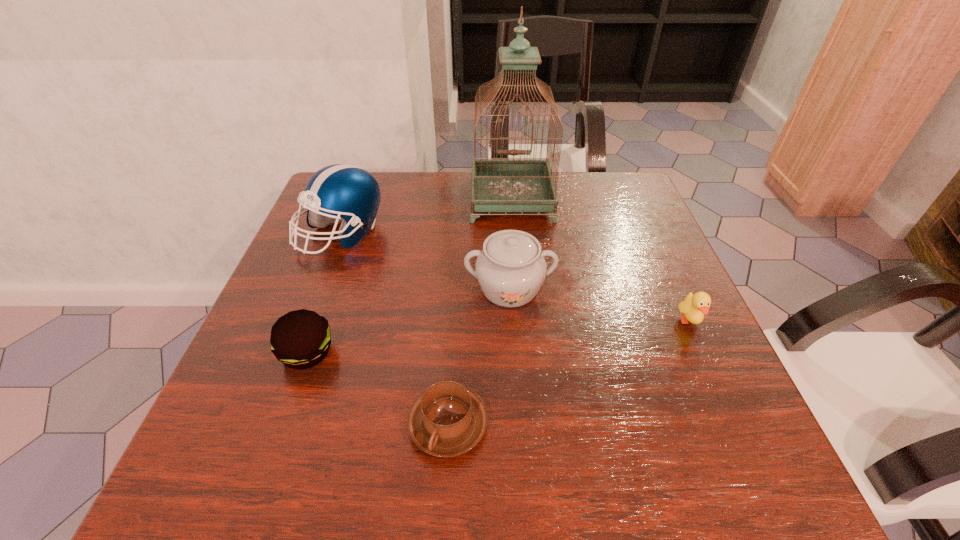
This screenshot has width=960, height=540. I want to click on vacant area between the cappuccino and the tallest object, so click(480, 312).

Locate an element on the screen. free area in between the third tallest object and the football helmet is located at coordinates (425, 261).

At what (x,y) coordinates should I click in order to perform the action: click on free area in between the tallest object and the rightmost object. Please return your answer as a coordinate pair (x, y). Looking at the image, I should click on (600, 260).

Where is `object identified as the fourth closest to the patty`? This screenshot has width=960, height=540. object identified as the fourth closest to the patty is located at coordinates (502, 184).

This screenshot has width=960, height=540. I want to click on object that stands as the fifth closest to the shortest object, so click(x=502, y=184).